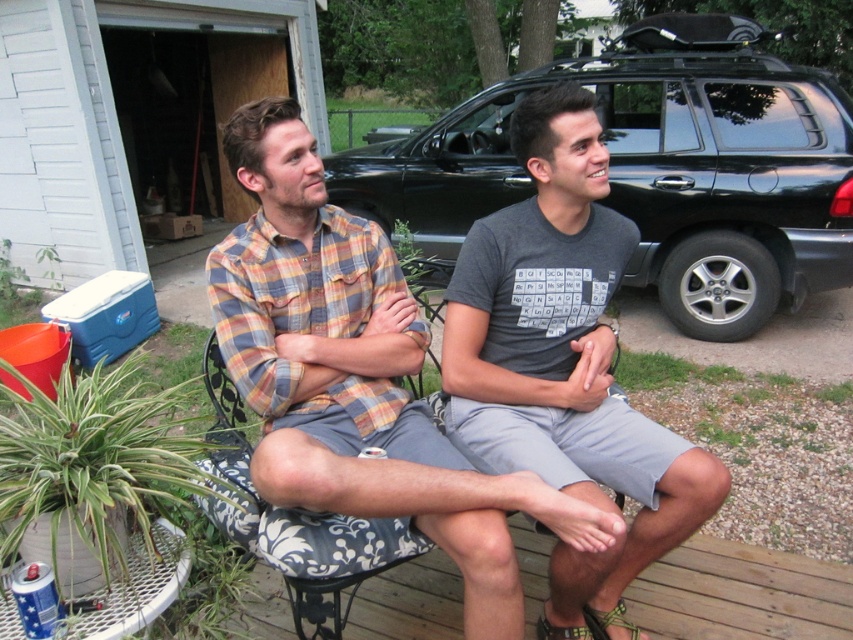
You are trying to determine which shirt is visible on top in the image. Based on the two shirts, the plaid cotton shirt at center and the gray fabric shirt at center, which one is covering the other?

The plaid cotton shirt at center is positioned over gray fabric shirt at center, so the plaid cotton shirt at center is covering the gray fabric shirt at center.

You are standing at the origin of a coordinate system placed at the bottom left corner of the wooden deck. There are two points marked on the deck. One is at point (399, 285) and the other is at point (548, 230). If you want to walk from the origin to the point that is behind the other, which point should you go to?

Point (399, 285) is behind point (548, 230), so you should go to point (399, 285).

You are trying to determine if the black matte suv at upper right can fit through a standard single car garage door that is 2.5 meters wide. Based on the comparison with the gray fabric shirt at center, can you estimate whether the suv will fit?

The black matte suv at upper right might be wider than gray fabric shirt at center. Since the gray fabric shirt at center is part of a person wearing light gray shorts, we can estimate the suv is wider than an average car. However, standard single car garage doors are 2.5 meters wide, which accommodates most vehicles. Without exact measurements, it is uncertain if the suv will fit.